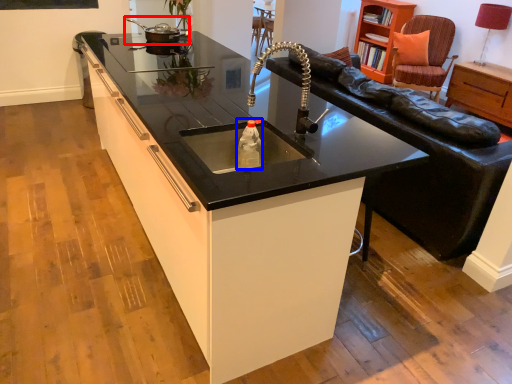
Question: Which of the following is the farthest to the observer, appliance (highlighted by a red box) or bottle (highlighted by a blue box)?

Choices:
 (A) appliance
 (B) bottle

Answer: (A)